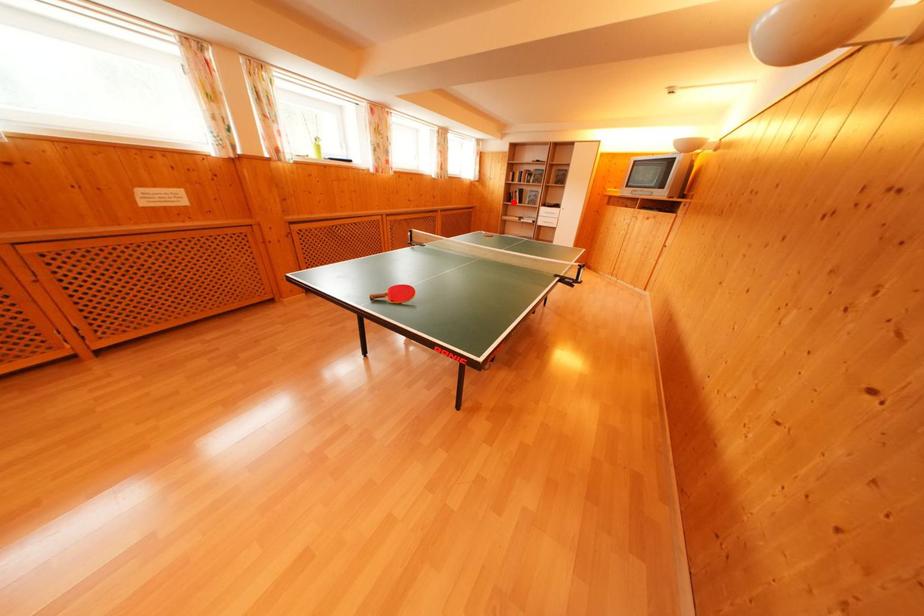
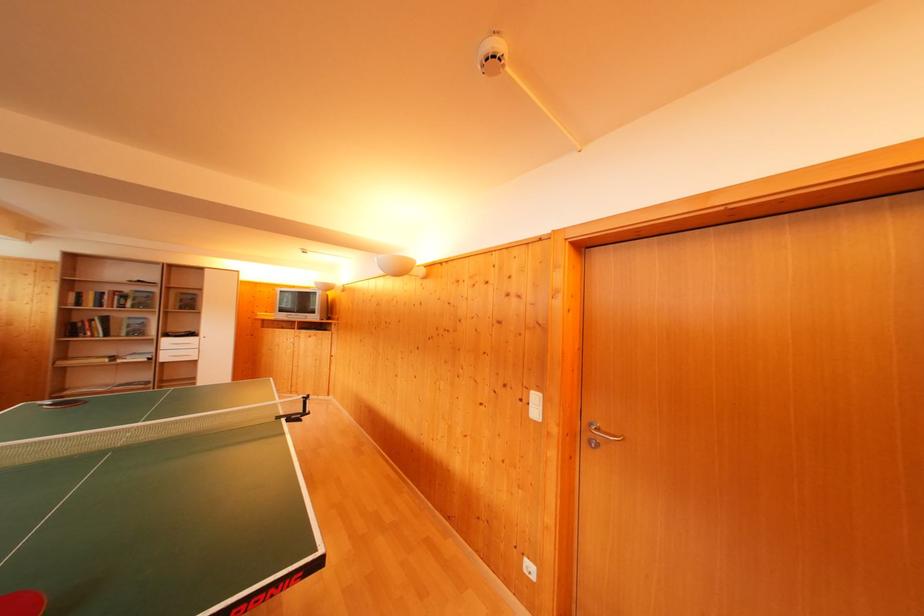
In the second image, find the point that corresponds to the highlighted location in the first image.

(76, 334)